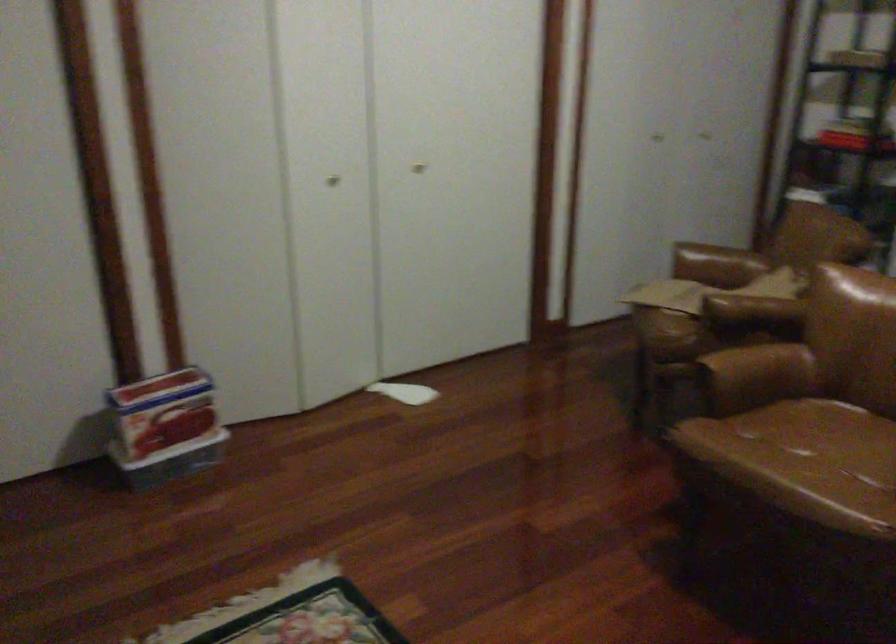
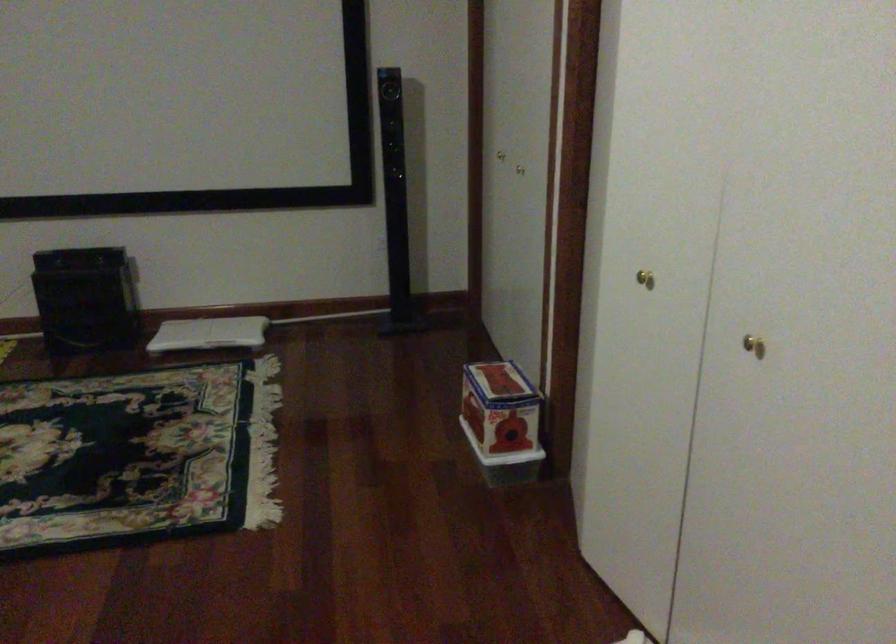
The point at (212, 390) is marked in the first image. Where is the corresponding point in the second image?

(501, 422)